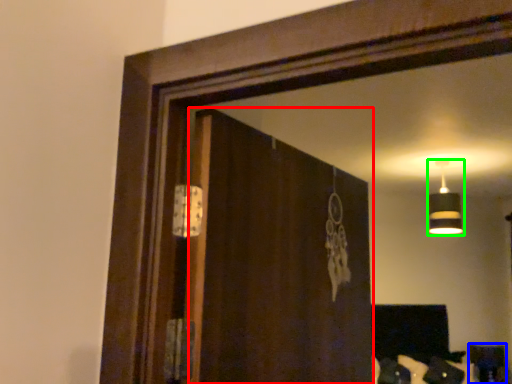
Question: Which object is the closest to the screen door (highlighted by a red box)? Choose among these: furniture (highlighted by a blue box) or lamp (highlighted by a green box).

Choices:
 (A) furniture
 (B) lamp

Answer: (B)